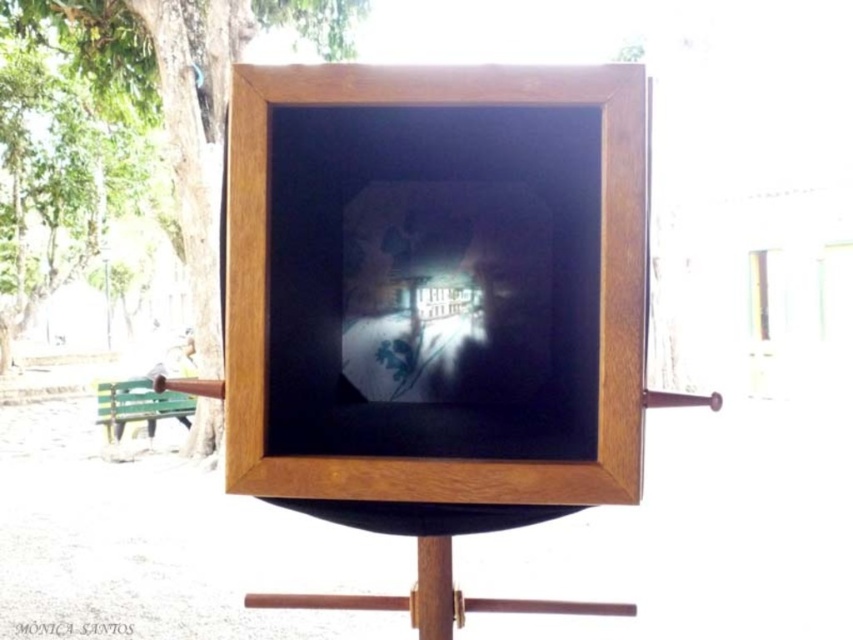
You are an artist setting up a new canvas. You have to decide where to place your easel. The scene has a smooth brown tree trunk at left and a green painted wood park bench at lower left. Which object is wider so you can use it as a reference for spacing?

The smooth brown tree trunk at left is wider than the green painted wood park bench at lower left, so you can use the tree trunk as a reference for spacing.